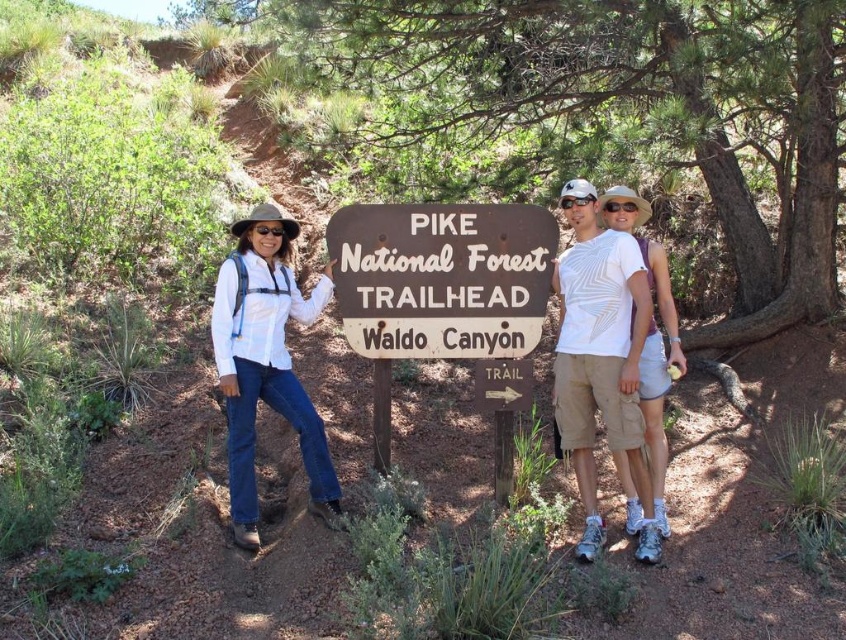
Can you confirm if brown wooden sign at center is wider than white textured shirt at center?

Yes, brown wooden sign at center is wider than white textured shirt at center.

Who is more forward, (374,257) or (580,390)?

Point (580,390) is more forward.

This screenshot has width=846, height=640. I want to click on brown wooden sign at center, so click(442, 276).

Does brown wooden sign at center come in front of white matte shirt at center?

No, it is not.

Which is more to the right, brown wooden sign at center or white matte shirt at center?

Positioned to the right is brown wooden sign at center.

Where is `brown wooden sign at center`? Image resolution: width=846 pixels, height=640 pixels. brown wooden sign at center is located at coordinates (442, 276).

Can you confirm if white textured shirt at center is bigger than white matte shirt at center?

Actually, white textured shirt at center might be smaller than white matte shirt at center.

Identify the location of white textured shirt at center. The width and height of the screenshot is (846, 640). (602, 358).